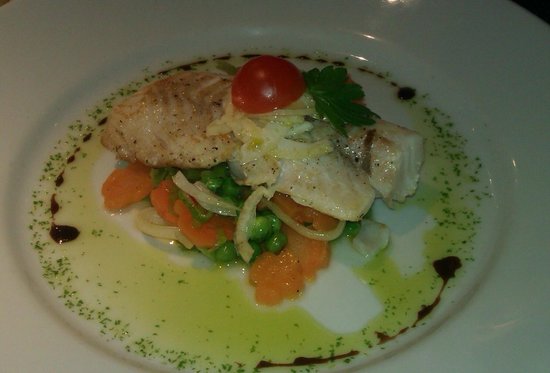
Locate an element on the screen. plate brim is located at coordinates (38, 347).